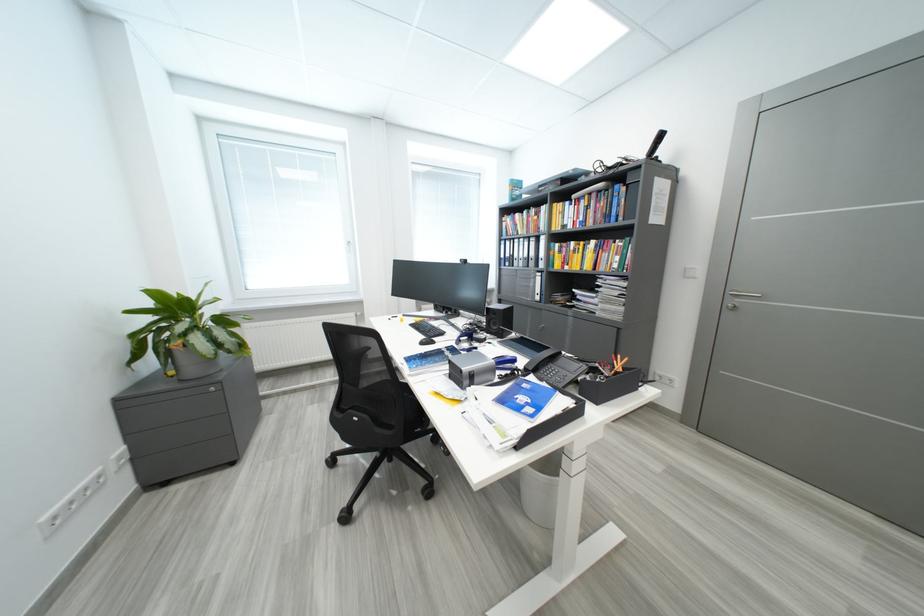
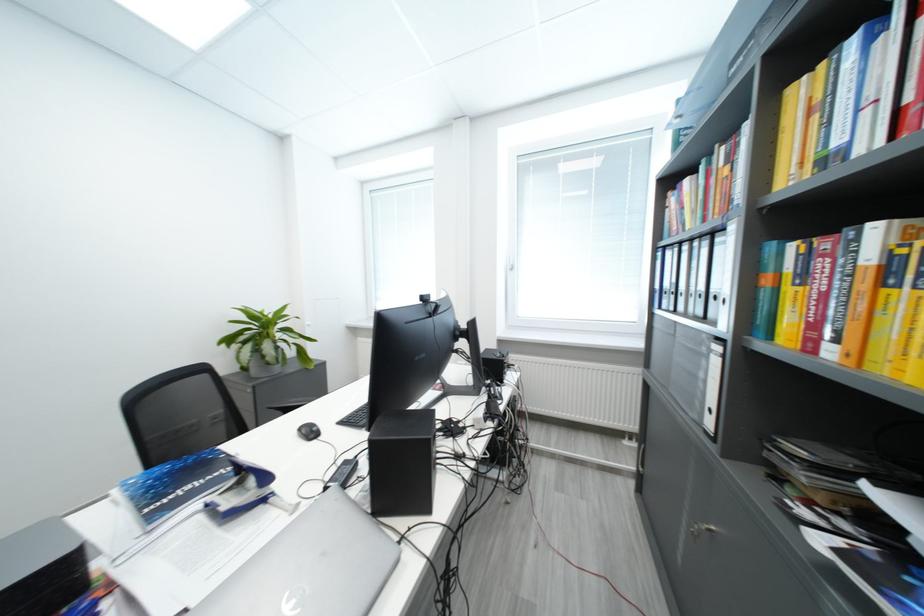
Locate, in the second image, the point that corresponds to the point at 189,331 in the first image.

(251, 341)